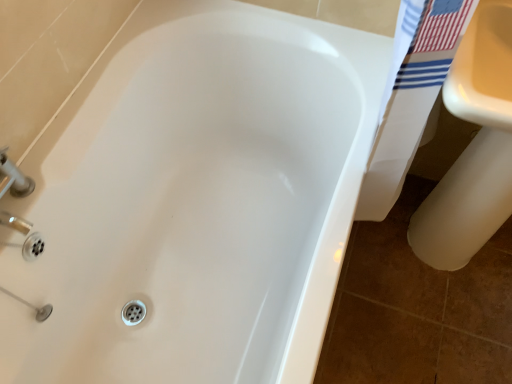
Question: Should I look upward or downward to see white glossy sink at lower right?

Choices:
 (A) up
 (B) down

Answer: (A)